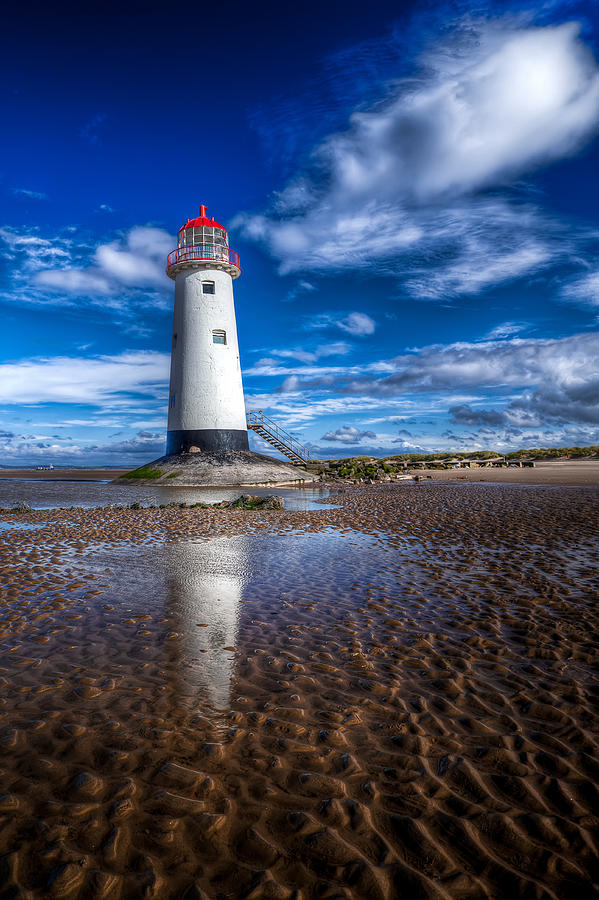
Locate an element on the screen. This screenshot has width=599, height=900. windows is located at coordinates (220, 234), (208, 234), (193, 234), (193, 237), (208, 246).